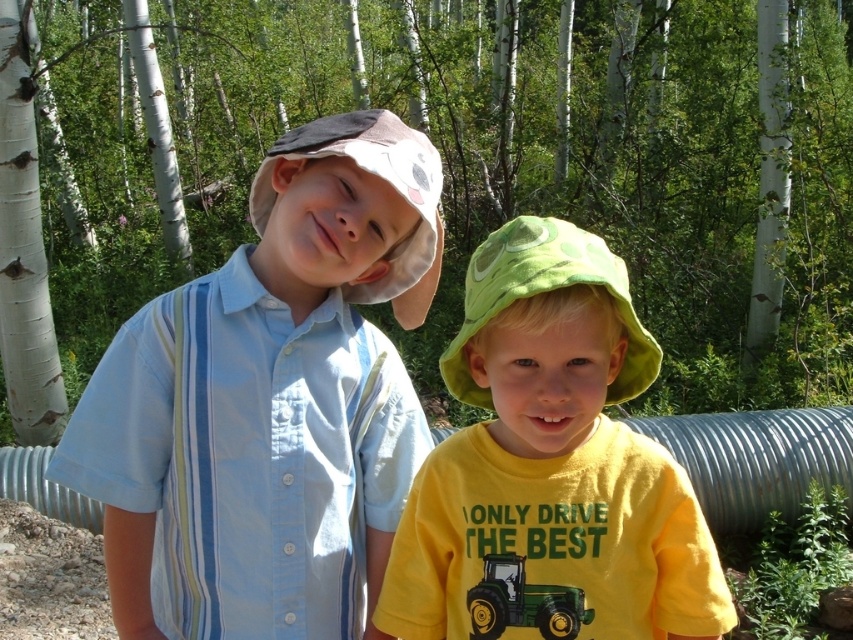
Question: Based on their relative distances, which object is farther from the light blue striped shirt at center?

Choices:
 (A) green matte tractor at lower center
 (B) yellow matte shirt at center
 (C) green leafy tree at center

Answer: (C)

Question: Is green leafy tree at center thinner than yellow matte shirt at center?

Choices:
 (A) yes
 (B) no

Answer: (B)

Question: Which is nearer to the green leafy tree at center?

Choices:
 (A) green matte tractor at lower center
 (B) yellow matte shirt at center
 (C) light blue striped shirt at center

Answer: (C)

Question: Does green leafy tree at center have a greater width compared to yellow matte shirt at center?

Choices:
 (A) yes
 (B) no

Answer: (A)

Question: Which of the following is the closest to the observer?

Choices:
 (A) (490, 632)
 (B) (461, 588)

Answer: (A)

Question: Does light blue striped shirt at center appear over yellow matte shirt at center?

Choices:
 (A) no
 (B) yes

Answer: (B)